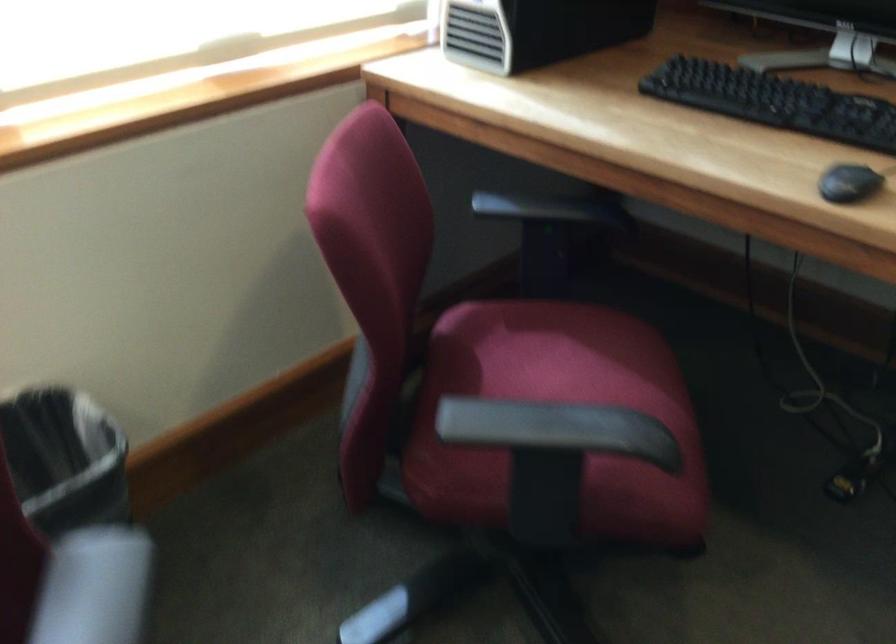
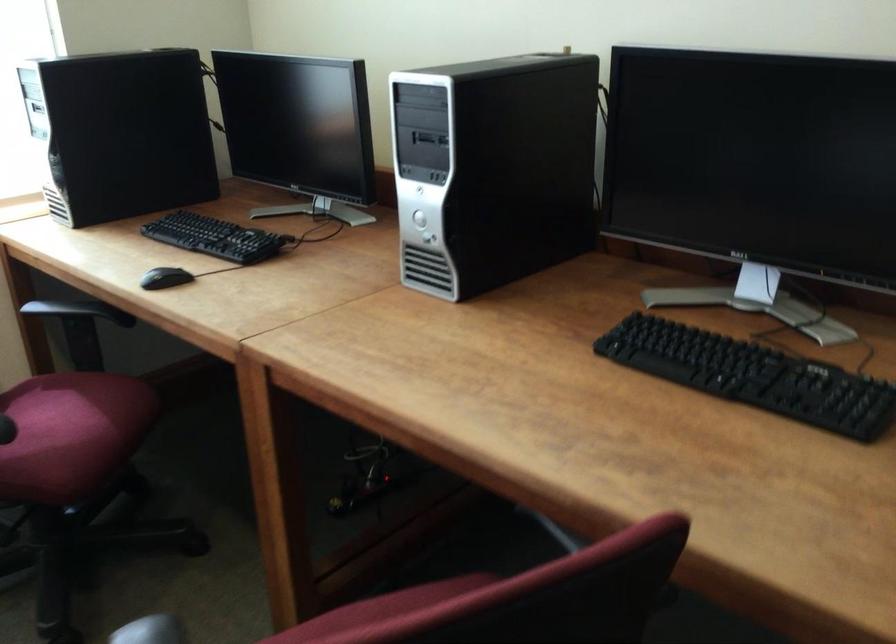
Where in the second image is the point corresponding to the point at 569,210 from the first image?

(74, 310)